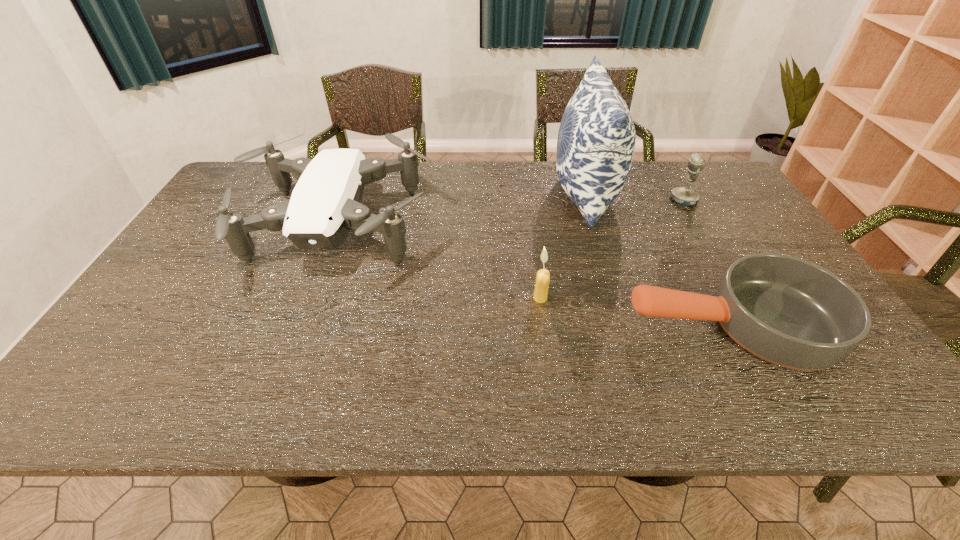
In order to click on unoccupied area between the cushion and the leftmost object in this screenshot , I will do `click(461, 210)`.

You are a GUI agent. You are given a task and a screenshot of the screen. Output one action in this format:
    pyautogui.click(x=<x>, y=<y>)
    Task: Click on the vacant space that is in between the drone and the tallest object
    This screenshot has height=540, width=960.
    Given the screenshot: What is the action you would take?
    pyautogui.click(x=461, y=210)

Where is `empty location between the drone and the cushion`? empty location between the drone and the cushion is located at coordinates (461, 210).

Image resolution: width=960 pixels, height=540 pixels. Find the location of `vacant space that is in between the cushion and the leftmost object`. vacant space that is in between the cushion and the leftmost object is located at coordinates (461, 210).

Locate an element on the screen. This screenshot has height=540, width=960. free space between the cushion and the drone is located at coordinates (461, 210).

At what (x,y) coordinates should I click in order to perform the action: click on object identified as the third closest to the candle. Please return your answer as a coordinate pair (x, y). The width and height of the screenshot is (960, 540). Looking at the image, I should click on (325, 205).

Select which object appears as the third closest to the microphone. Please provide its 2D coordinates. Your answer should be formatted as a tuple, i.e. [(x, y)], where the tuple contains the x and y coordinates of a point satisfying the conditions above.

[(543, 276)]

This screenshot has height=540, width=960. In order to click on free space that satisfies the following two spatial constraints: 1. on the front-facing side of the microphone; 2. on the camera side of the leftmost object in this screenshot , I will do click(699, 227).

The width and height of the screenshot is (960, 540). Find the location of `vacant space that satisfies the following two spatial constraints: 1. on the front surface of the tallest object; 2. on the camera side of the drone`. vacant space that satisfies the following two spatial constraints: 1. on the front surface of the tallest object; 2. on the camera side of the drone is located at coordinates (594, 227).

The image size is (960, 540). In order to click on vacant area that satisfies the following two spatial constraints: 1. on the front surface of the cushion; 2. on the front side of the candle in this screenshot , I will do `click(616, 298)`.